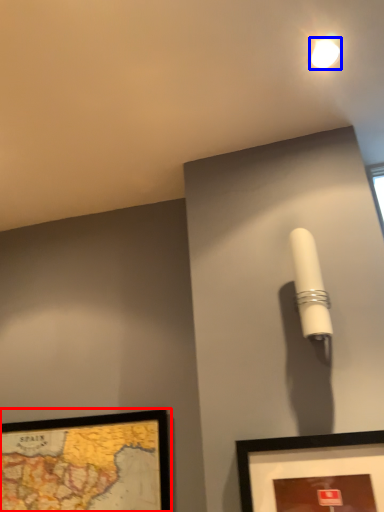
Question: Which object appears closest to the camera in this image, picture frame (highlighted by a red box) or droplight (highlighted by a blue box)?

Choices:
 (A) picture frame
 (B) droplight

Answer: (B)